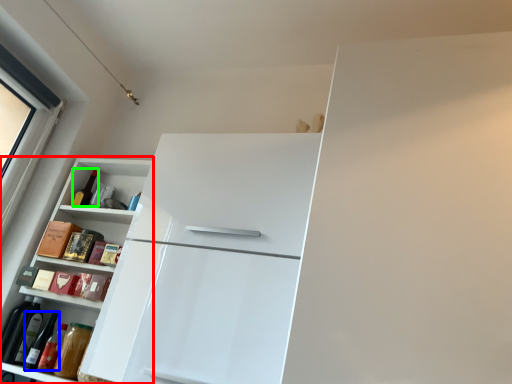
Question: Which is farther away from cabinetry (highlighted by a red box)? wine bottle (highlighted by a blue box) or bottle (highlighted by a green box)?

Choices:
 (A) wine bottle
 (B) bottle

Answer: (A)